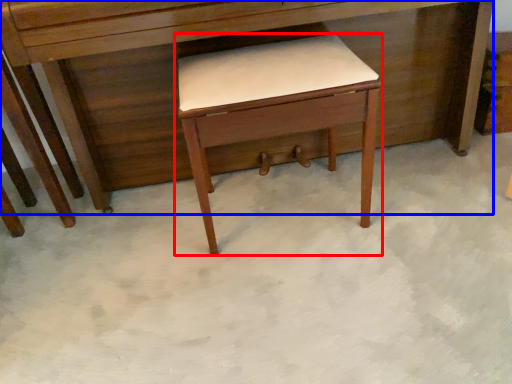
Question: Which of the following is the farthest to the observer, table (highlighted by a red box) or desk (highlighted by a blue box)?

Choices:
 (A) table
 (B) desk

Answer: (A)